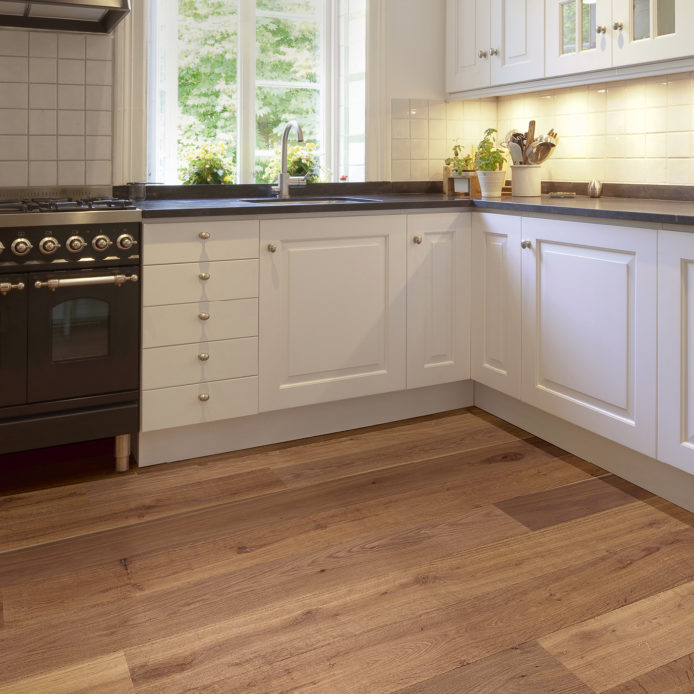
You are a GUI agent. You are given a task and a screenshot of the screen. Output one action in this format:
    pyautogui.click(x=<x>, y=<y>)
    Task: Click on the kitchen counter
    The width and height of the screenshot is (694, 694).
    Given the screenshot: What is the action you would take?
    click(x=647, y=202), click(x=189, y=201)